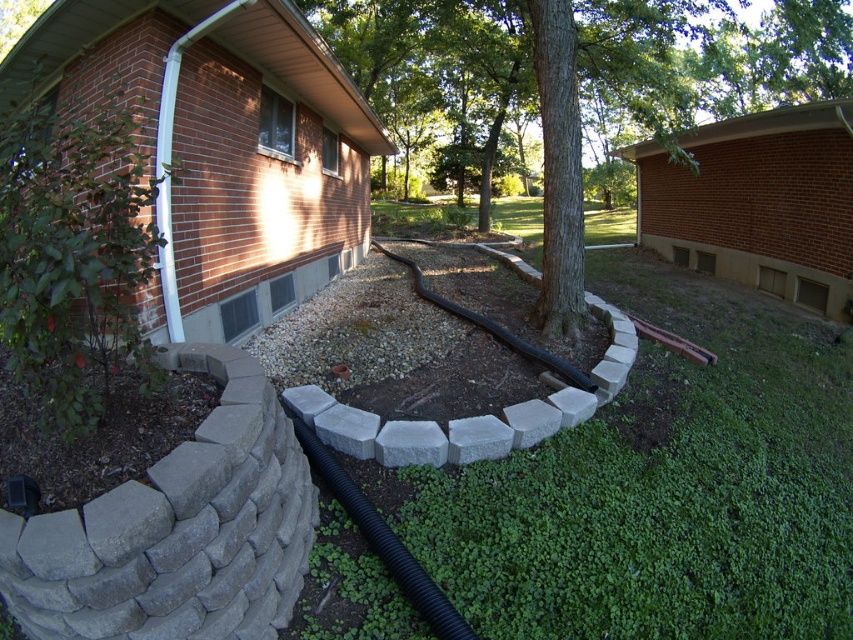
Is green textured tree at center taller than black rubber hose at center?

Correct, green textured tree at center is much taller as black rubber hose at center.

The width and height of the screenshot is (853, 640). In order to click on green textured tree at center in this screenshot , I will do `click(589, 74)`.

Which is in front, point (846, 77) or point (447, 608)?

Point (447, 608)

Identify the location of green textured tree at center. The height and width of the screenshot is (640, 853). (589, 74).

What do you see at coordinates (589, 74) in the screenshot? The height and width of the screenshot is (640, 853). I see `green textured tree at center` at bounding box center [589, 74].

Does point (546, 99) come farther from viewer compared to point (457, 314)?

No, it is in front of (457, 314).

Locate an element on the screen. green textured tree at center is located at coordinates (589, 74).

Between black rubber hose at center and black rubber garden hose at center, which one has less height?

black rubber garden hose at center is shorter.

Is black rubber hose at center positioned before black rubber garden hose at center?

Yes, it is in front of black rubber garden hose at center.

In order to click on black rubber hose at center in this screenshot , I will do `click(381, 540)`.

This screenshot has width=853, height=640. I want to click on black rubber hose at center, so click(x=381, y=540).